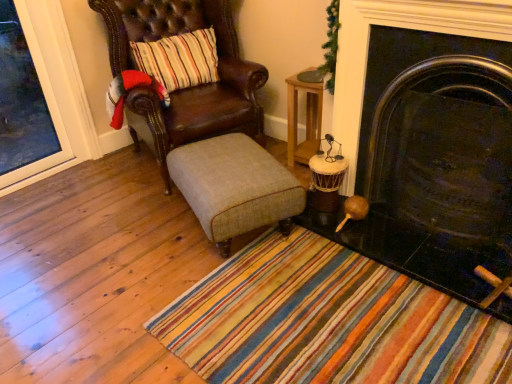
Question: Would you say black glossy fireplace at right is inside or outside wooden candle holder at lower right?

Choices:
 (A) outside
 (B) inside

Answer: (A)

Question: Does point (364, 226) appear closer or farther from the camera than point (330, 170)?

Choices:
 (A) farther
 (B) closer

Answer: (B)

Question: Estimate the real-world distances between objects in this image. Which object is closer to the wooden candle holder at lower right?

Choices:
 (A) wooden table at upper right
 (B) beige fabric stool at center
 (C) black glossy fireplace at right
 (D) leather chair at left

Answer: (B)

Question: Estimate the real-world distances between objects in this image. Which object is closer to the wooden table at upper right?

Choices:
 (A) leather chair at left
 (B) wooden candle holder at lower right
 (C) black glossy fireplace at right
 (D) beige fabric stool at center

Answer: (B)